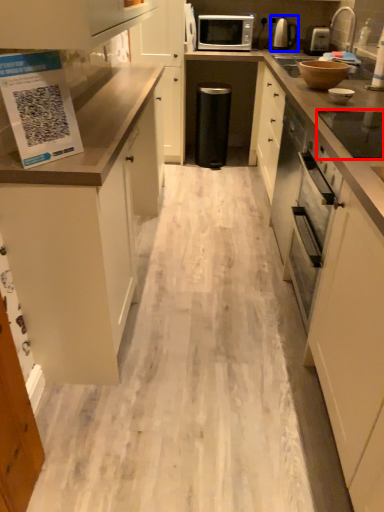
Question: Which point is closer to the camera, appliance (highlighted by a red box) or kitchen appliance (highlighted by a blue box)?

Choices:
 (A) appliance
 (B) kitchen appliance

Answer: (A)